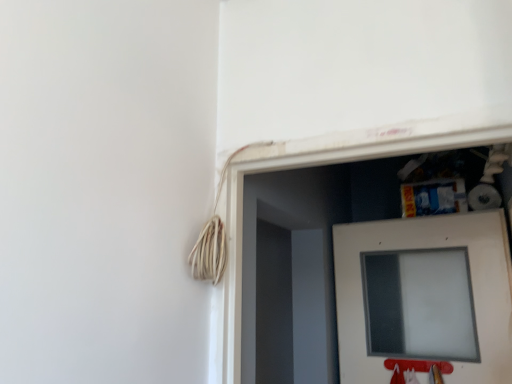
Where is `frosted glass window at lower right`? The width and height of the screenshot is (512, 384). frosted glass window at lower right is located at coordinates (420, 304).

This screenshot has width=512, height=384. Describe the element at coordinates (420, 304) in the screenshot. I see `frosted glass window at lower right` at that location.

Image resolution: width=512 pixels, height=384 pixels. Describe the element at coordinates (425, 297) in the screenshot. I see `white matte door at center` at that location.

You are a GUI agent. You are given a task and a screenshot of the screen. Output one action in this format:
    pyautogui.click(x=<x>, y=<y>)
    Task: Click on the white matte door at center
    
    Given the screenshot: What is the action you would take?
    pyautogui.click(x=425, y=297)

In order to face white matte door at center, should I rotate leftwards or rightwards?

It's best to rotate right around 20.924 degrees.

Identify the location of frosted glass window at lower right. (420, 304).

Which object is positioned more to the left, white matte door at center or frosted glass window at lower right?

frosted glass window at lower right is more to the left.

Which object is more forward, white matte door at center or frosted glass window at lower right?

white matte door at center.

Is point (490, 370) positioned behind point (408, 260)?

No, it is not.

From the image's perspective, who appears lower, white matte door at center or frosted glass window at lower right?

frosted glass window at lower right is shown below in the image.

From a real-world perspective, which object stands above the other?

In real-world perspective, white matte door at center is above.

Is white matte door at center wider or thinner than frosted glass window at lower right?

In the image, white matte door at center appears to be more narrow than frosted glass window at lower right.

Is white matte door at center shorter than frosted glass window at lower right?

In fact, white matte door at center may be taller than frosted glass window at lower right.

Looking at the image, does white matte door at center seem bigger or smaller compared to frosted glass window at lower right?

Clearly, white matte door at center is larger in size than frosted glass window at lower right.

Do you think white matte door at center is within frosted glass window at lower right, or outside of it?

The correct answer is: outside.

Is white matte door at center placed right next to frosted glass window at lower right?

Yes, white matte door at center is beside frosted glass window at lower right.

Is white matte door at center facing towards frosted glass window at lower right?

Yes, white matte door at center is aimed at frosted glass window at lower right.

What's the angular difference between white matte door at center and frosted glass window at lower right's facing directions?

2.79 degrees separate the facing orientations of white matte door at center and frosted glass window at lower right.

Where is `computer screen below the white matte door at center (from the image's perspective)`? This screenshot has height=384, width=512. computer screen below the white matte door at center (from the image's perspective) is located at coordinates (420, 304).

Can you confirm if frosted glass window at lower right is positioned to the right of white matte door at center?

No, frosted glass window at lower right is not to the right of white matte door at center.

Does frosted glass window at lower right come in front of white matte door at center?

That is False.

Between point (452, 281) and point (511, 316), which one is positioned in front?

The point (511, 316) is more forward.

From the image's perspective, who appears lower, frosted glass window at lower right or white matte door at center?

frosted glass window at lower right is shown below in the image.

From a real-world perspective, between frosted glass window at lower right and white matte door at center, who is vertically lower?

frosted glass window at lower right.

Does frosted glass window at lower right have a greater width compared to white matte door at center?

Correct, the width of frosted glass window at lower right exceeds that of white matte door at center.

Looking at this image, who is taller, frosted glass window at lower right or white matte door at center?

With more height is white matte door at center.

Considering the relative sizes of frosted glass window at lower right and white matte door at center in the image provided, is frosted glass window at lower right smaller than white matte door at center?

Yes, frosted glass window at lower right is smaller than white matte door at center.

In the scene shown: Do you think frosted glass window at lower right is within white matte door at center, or outside of it?

frosted glass window at lower right is spatially situated outside white matte door at center.

Is frosted glass window at lower right beside white matte door at center?

Yes, frosted glass window at lower right is next to white matte door at center.

Could you tell me if frosted glass window at lower right is turned towards white matte door at center?

Yes, frosted glass window at lower right is oriented towards white matte door at center.

What's the angular difference between frosted glass window at lower right and white matte door at center's facing directions?

2.79 degrees.

In the image, there is a white matte door at center. At what (x,y) coordinates should I click in order to perform the action: click on computer screen below it (from a real-world perspective). Please return your answer as a coordinate pair (x, y). This screenshot has width=512, height=384. Looking at the image, I should click on (420, 304).

At what (x,y) coordinates should I click in order to perform the action: click on door located above the frosted glass window at lower right (from a real-world perspective). Please return your answer as a coordinate pair (x, y). Looking at the image, I should click on (425, 297).

Identify the location of computer screen below the white matte door at center (from a real-world perspective). (420, 304).